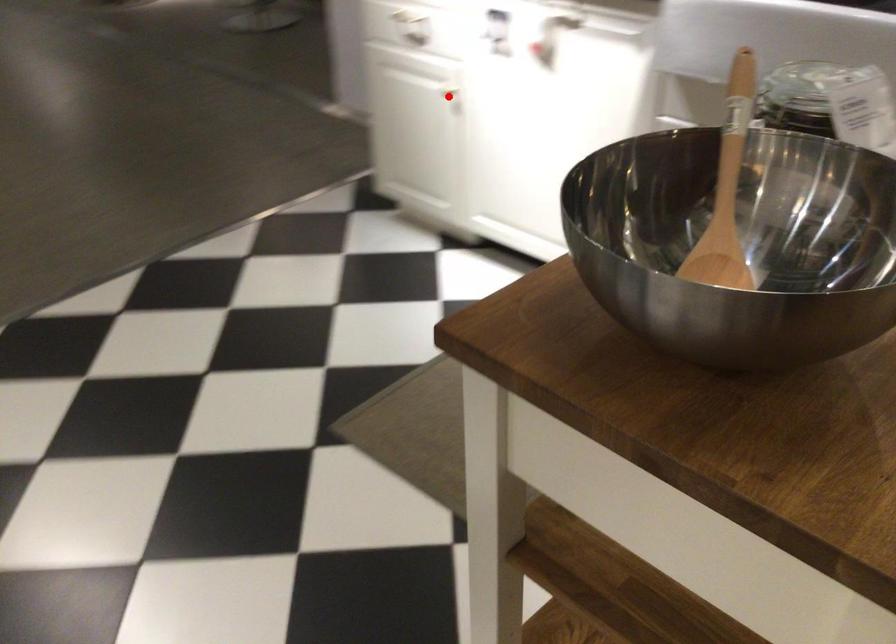
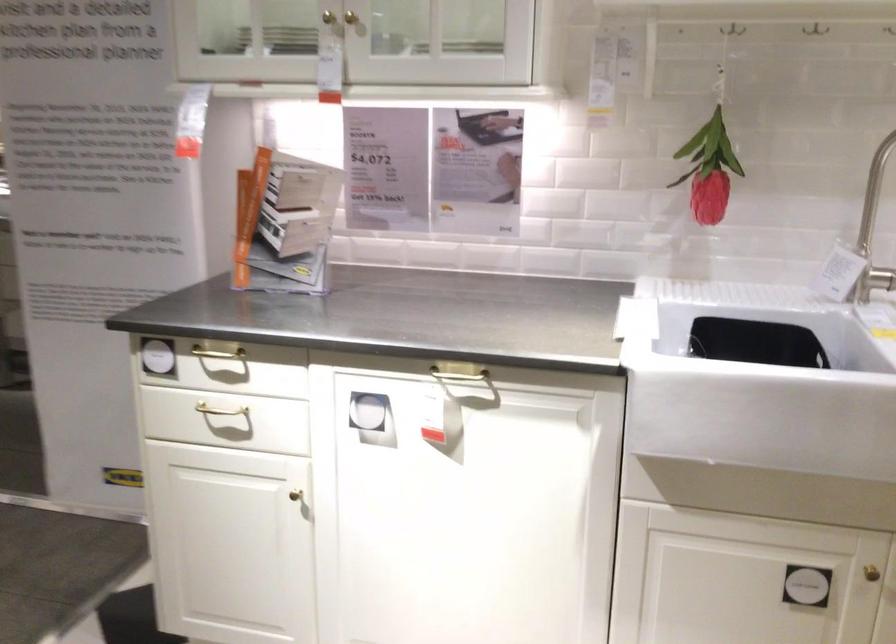
In the second image, find the point that corresponds to the highlighted location in the first image.

(296, 496)